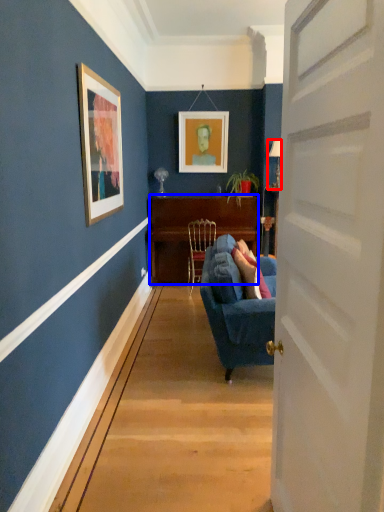
Question: Among these objects, which one is nearest to the camera, lamp (highlighted by a red box) or desk (highlighted by a blue box)?

Choices:
 (A) lamp
 (B) desk

Answer: (A)